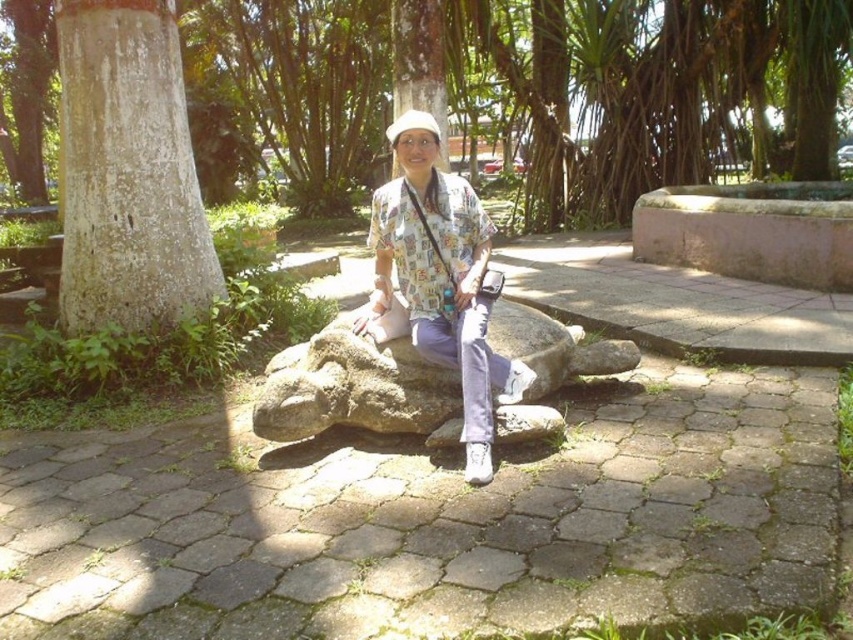
Is white rough textured tree trunk at left further to camera compared to matte floral shirt at center?

Yes, it is.

Who is shorter, white rough textured tree trunk at left or matte floral shirt at center?

matte floral shirt at center is shorter.

Where is `white rough textured tree trunk at left`? Image resolution: width=853 pixels, height=640 pixels. white rough textured tree trunk at left is located at coordinates (128, 170).

Locate an element on the screen. white rough textured tree trunk at left is located at coordinates (128, 170).